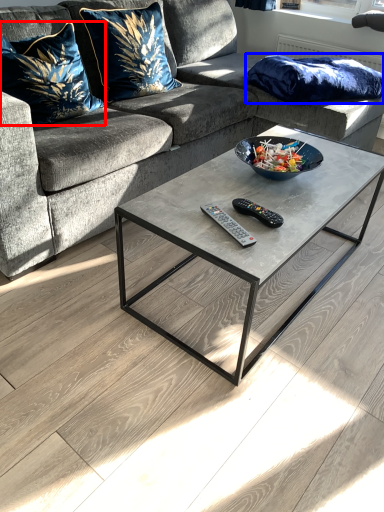
Question: Which object appears closest to the camera in this image, pillow (highlighted by a red box) or pillow (highlighted by a blue box)?

Choices:
 (A) pillow
 (B) pillow

Answer: (A)